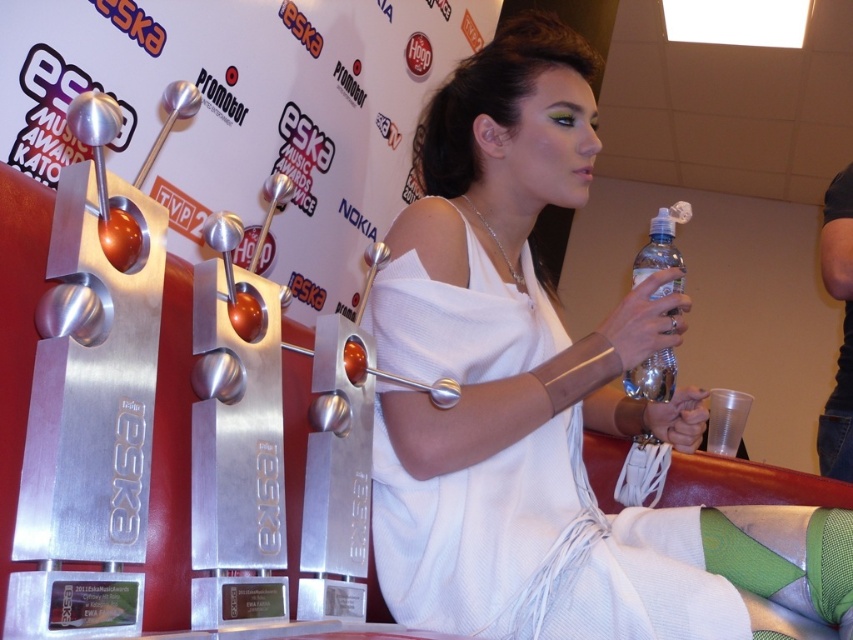
Is white fabric dress at center shorter than clear plastic bottle at center?

Incorrect, white fabric dress at center's height does not fall short of clear plastic bottle at center's.

Is white fabric dress at center to the right of clear plastic bottle at center from the viewer's perspective?

Incorrect, white fabric dress at center is not on the right side of clear plastic bottle at center.

Which is in front, point (453, 184) or point (662, 392)?

Point (453, 184) is more forward.

This screenshot has height=640, width=853. Identify the location of white fabric dress at center. (549, 403).